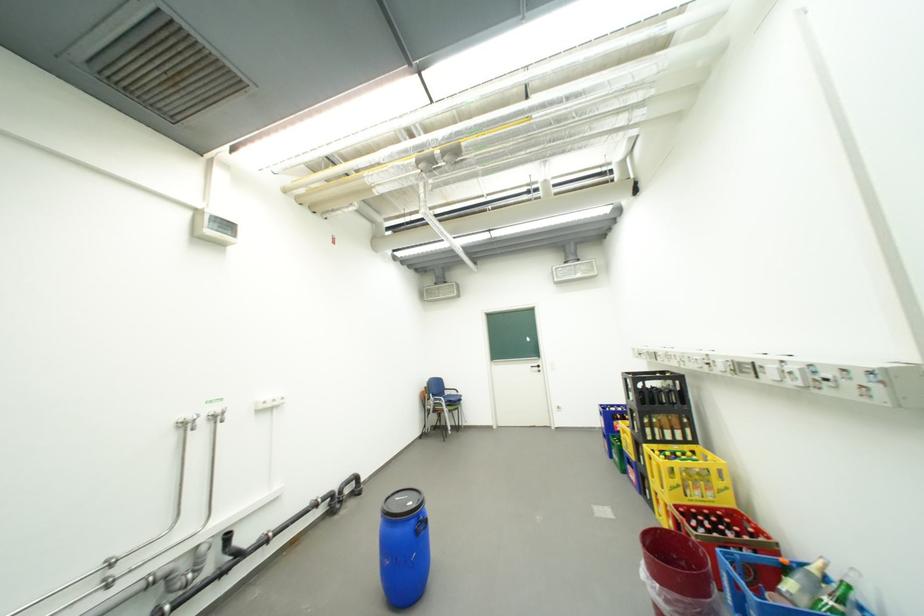
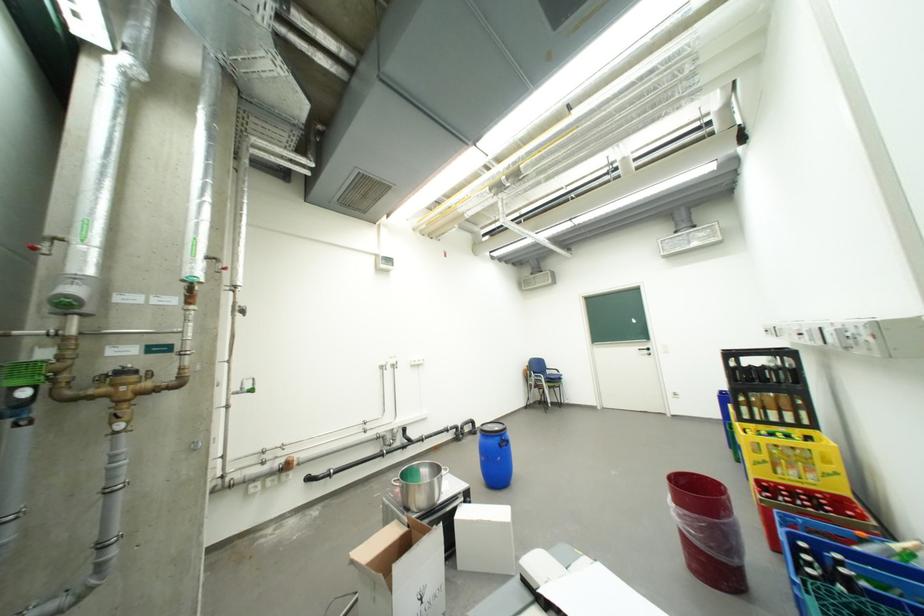
In the second image, find the point that corresponds to (541,368) in the first image.

(650, 351)